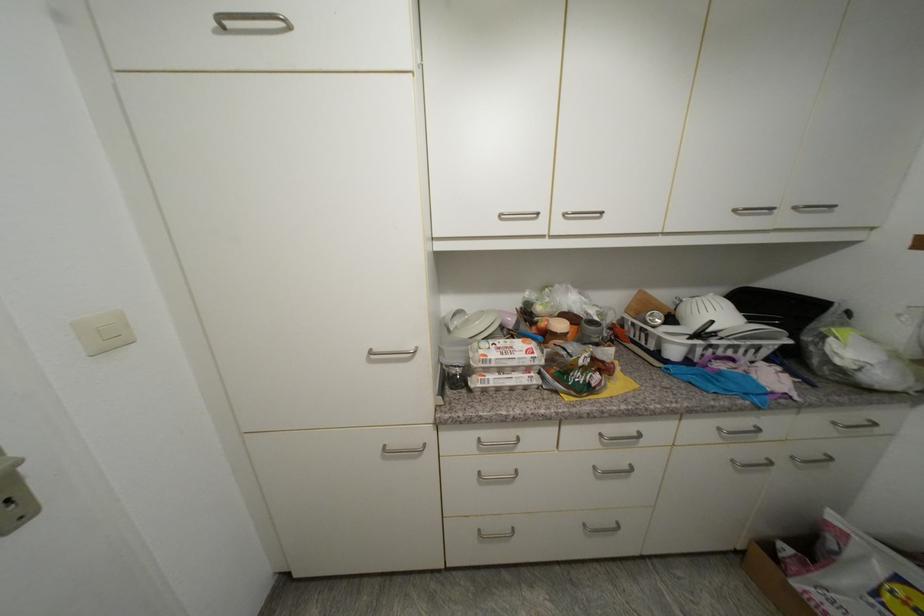
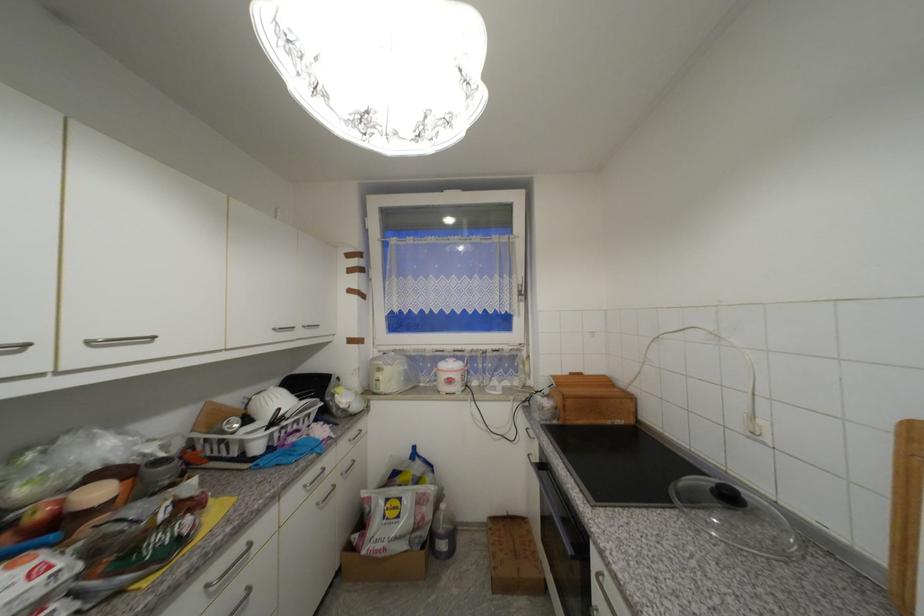
In the second image, find the point that corresponds to point (845, 406) in the first image.

(354, 430)